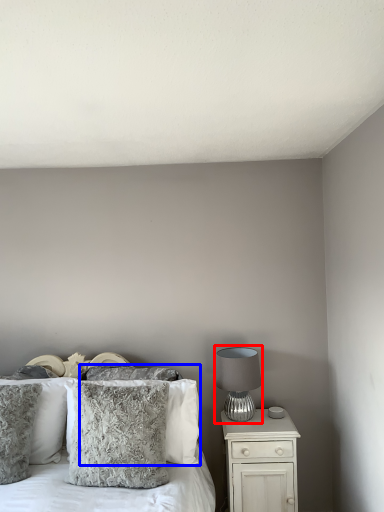
Question: Which of the following is the farthest to the observer, table lamp (highlighted by a red box) or pillow (highlighted by a blue box)?

Choices:
 (A) table lamp
 (B) pillow

Answer: (A)